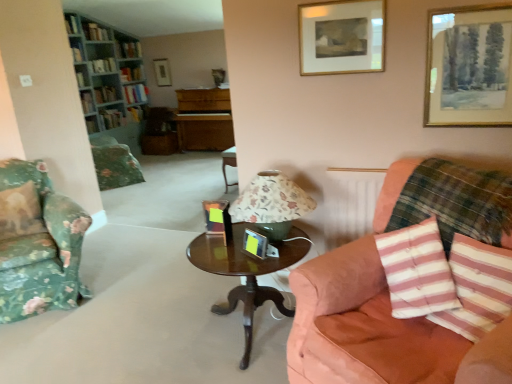
Question: From a real-world perspective, is floral fabric lampshade at center above or below hardcover book at center, placed as the sixth book when sorted from bottom to top?

Choices:
 (A) below
 (B) above

Answer: (A)

Question: Considering their positions, is floral fabric lampshade at center located in front of or behind hardcover book at center, placed as the sixth book when sorted from bottom to top?

Choices:
 (A) front
 (B) behind

Answer: (A)

Question: Which is farther from the hardcover book at upper left, which appears as the eighth book when viewed from the top?

Choices:
 (A) suede-like pink couch at right
 (B) wooden picture frame at upper center, the 5th picture frame viewed from the front
 (C) hardcover book at upper left, the 9th book in the top-to-bottom sequence
 (D) hardcover book at upper left, the 10th book ordered from the bottom
 (E) metallic gold picture frame at center, which appears as the fourth picture frame when viewed from the back

Answer: (A)

Question: Which of these objects is positioned closest to the wooden picture frame at upper center, which is counted as the 5th picture frame, starting from the right?

Choices:
 (A) hardcover book at center, placed as the sixth book when sorted from bottom to top
 (B) green fabric book at upper left, which ranks as the 2th book in bottom-to-top order
 (C) hardcover book at upper left, which is the first book in top-to-bottom order
 (D) green floral fabric chair at left, positioned as the 1th chair in back-to-front order
 (E) hardcover book at upper left, which is the third book in bottom-to-top order

Answer: (A)